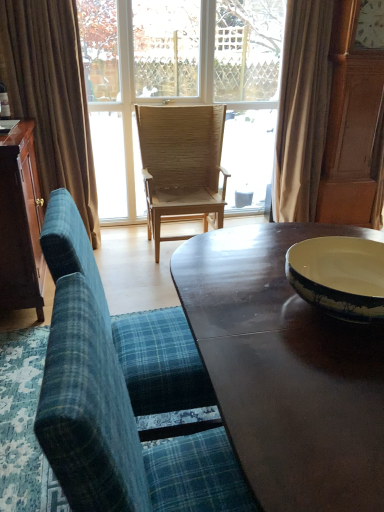
Locate an element on the screen. This screenshot has height=512, width=384. blank area to the left of yellow ceramic bowl at right is located at coordinates click(236, 308).